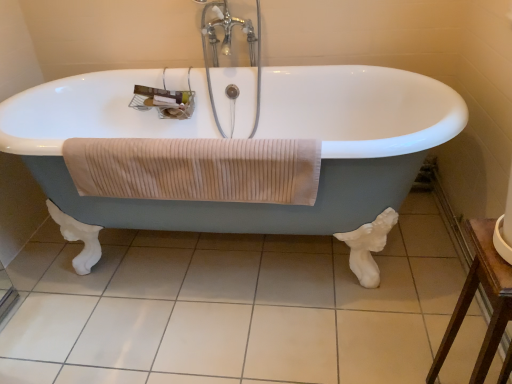
Question: Would you say beige ribbed towel at center is part of white tile at center's contents?

Choices:
 (A) no
 (B) yes

Answer: (A)

Question: Can you confirm if white tile at center is wider than beige ribbed towel at center?

Choices:
 (A) no
 (B) yes

Answer: (B)

Question: Considering the relative sizes of white tile at center and beige ribbed towel at center in the image provided, is white tile at center smaller than beige ribbed towel at center?

Choices:
 (A) no
 (B) yes

Answer: (A)

Question: Can you confirm if white tile at center is shorter than beige ribbed towel at center?

Choices:
 (A) no
 (B) yes

Answer: (B)

Question: From the image's perspective, does white tile at center appear lower than beige ribbed towel at center?

Choices:
 (A) yes
 (B) no

Answer: (A)

Question: From their relative heights in the image, would you say beige ribbed towel at center is taller or shorter than white glossy bathtub at center?

Choices:
 (A) short
 (B) tall

Answer: (A)

Question: Based on their sizes in the image, would you say beige ribbed towel at center is bigger or smaller than white glossy bathtub at center?

Choices:
 (A) big
 (B) small

Answer: (B)

Question: Is beige ribbed towel at center wider or thinner than white glossy bathtub at center?

Choices:
 (A) thin
 (B) wide

Answer: (A)

Question: Considering their positions, is beige ribbed towel at center located in front of or behind white glossy bathtub at center?

Choices:
 (A) behind
 (B) front

Answer: (A)

Question: Relative to white glossy bathtub at center, is chrome metallic faucet at upper center in front or behind?

Choices:
 (A) front
 (B) behind

Answer: (B)

Question: Is chrome metallic faucet at upper center inside the boundaries of white glossy bathtub at center, or outside?

Choices:
 (A) inside
 (B) outside

Answer: (A)

Question: Based on their positions, is chrome metallic faucet at upper center located to the left or right of white glossy bathtub at center?

Choices:
 (A) right
 (B) left

Answer: (A)

Question: Considering the positions of chrome metallic faucet at upper center and white glossy bathtub at center in the image, is chrome metallic faucet at upper center bigger or smaller than white glossy bathtub at center?

Choices:
 (A) small
 (B) big

Answer: (A)

Question: From the image's perspective, is white tile at center positioned above or below brown wooden table at lower right?

Choices:
 (A) below
 (B) above

Answer: (B)

Question: Is white tile at center spatially inside brown wooden table at lower right, or outside of it?

Choices:
 (A) outside
 (B) inside

Answer: (A)